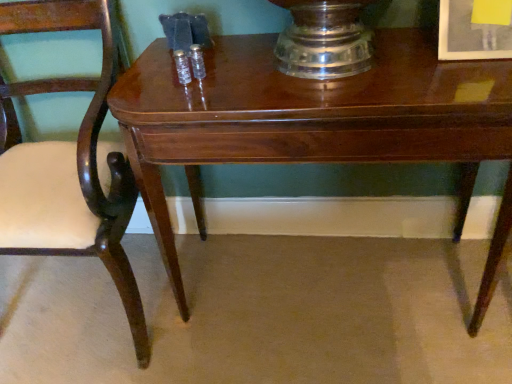
What are the coordinates of `free spot below glossy wood table at center (from a real-world perspective)` in the screenshot? It's located at (322, 280).